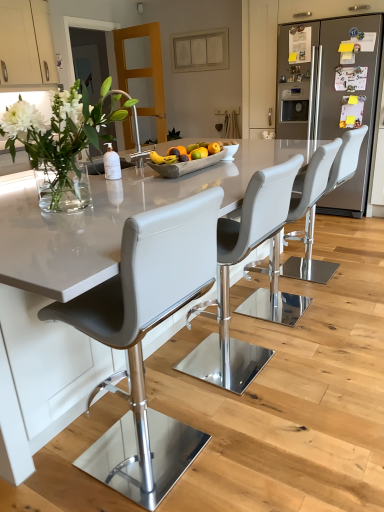
Question: Is matte white cabinet at upper left behind white leather bar stool at center, acting as the fourth chair starting from the front?

Choices:
 (A) no
 (B) yes

Answer: (B)

Question: Is matte white cabinet at upper left closer to the viewer compared to white leather bar stool at center, placed as the first chair when sorted from back to front?

Choices:
 (A) yes
 (B) no

Answer: (B)

Question: Can you confirm if matte white cabinet at upper left is wider than white leather bar stool at center, placed as the first chair when sorted from back to front?

Choices:
 (A) no
 (B) yes

Answer: (A)

Question: From the image's perspective, would you say matte white cabinet at upper left is shown under white leather bar stool at center, acting as the fourth chair starting from the front?

Choices:
 (A) yes
 (B) no

Answer: (B)

Question: Is white leather bar stool at center, acting as the fourth chair starting from the front, completely or partially inside matte white cabinet at upper left?

Choices:
 (A) no
 (B) yes

Answer: (A)

Question: Could you tell me if matte white cabinet at upper left is turned towards white leather bar stool at center, placed as the first chair when sorted from back to front?

Choices:
 (A) no
 (B) yes

Answer: (B)

Question: Is clear glass vase at left wider than matte white cabinet at upper left?

Choices:
 (A) yes
 (B) no

Answer: (A)

Question: Considering the relative sizes of clear glass vase at left and matte white cabinet at upper left in the image provided, is clear glass vase at left shorter than matte white cabinet at upper left?

Choices:
 (A) no
 (B) yes

Answer: (B)

Question: Considering the relative sizes of clear glass vase at left and matte white cabinet at upper left in the image provided, is clear glass vase at left thinner than matte white cabinet at upper left?

Choices:
 (A) yes
 (B) no

Answer: (B)

Question: From a real-world perspective, is clear glass vase at left over matte white cabinet at upper left?

Choices:
 (A) no
 (B) yes

Answer: (A)

Question: Is clear glass vase at left further to the viewer compared to matte white cabinet at upper left?

Choices:
 (A) yes
 (B) no

Answer: (B)

Question: Could you tell me if clear glass vase at left is facing matte white cabinet at upper left?

Choices:
 (A) no
 (B) yes

Answer: (A)

Question: From a real-world perspective, does white glossy table at center sit lower than clear glass vase at left?

Choices:
 (A) yes
 (B) no

Answer: (A)